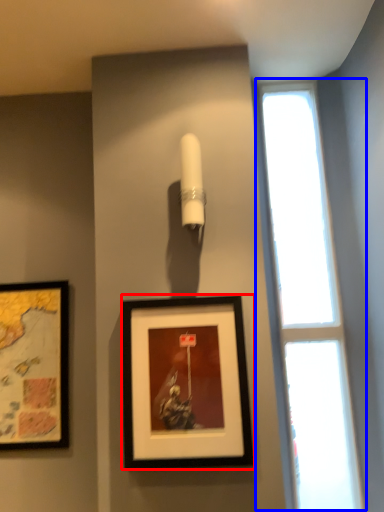
Question: Which object appears closest to the camera in this image, picture frame (highlighted by a red box) or window (highlighted by a blue box)?

Choices:
 (A) picture frame
 (B) window

Answer: (A)